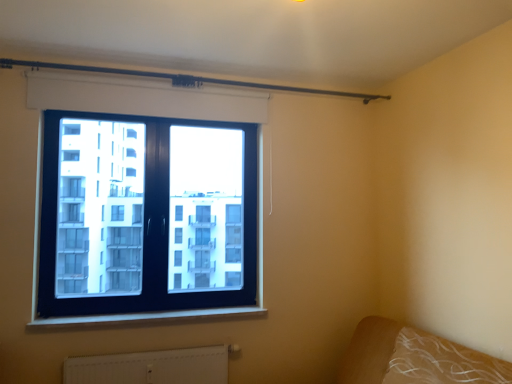
Question: Is metallic rod at upper center looking in the opposite direction of brown fabric bed at lower right?

Choices:
 (A) no
 (B) yes

Answer: (A)

Question: Is metallic rod at upper center completely or partially outside of brown fabric bed at lower right?

Choices:
 (A) yes
 (B) no

Answer: (A)

Question: Could you tell me if metallic rod at upper center is facing brown fabric bed at lower right?

Choices:
 (A) yes
 (B) no

Answer: (B)

Question: From the image's perspective, is metallic rod at upper center on top of brown fabric bed at lower right?

Choices:
 (A) yes
 (B) no

Answer: (A)

Question: Is metallic rod at upper center smaller than brown fabric bed at lower right?

Choices:
 (A) no
 (B) yes

Answer: (B)

Question: In the image, is black glass window at upper left positioned in front of or behind white plastic window sill at lower center?

Choices:
 (A) behind
 (B) front

Answer: (A)

Question: From the image's perspective, is black glass window at upper left above or below white plastic window sill at lower center?

Choices:
 (A) above
 (B) below

Answer: (A)

Question: From their relative heights in the image, would you say black glass window at upper left is taller or shorter than white plastic window sill at lower center?

Choices:
 (A) short
 (B) tall

Answer: (B)

Question: Looking at the image, does black glass window at upper left seem bigger or smaller compared to white plastic window sill at lower center?

Choices:
 (A) small
 (B) big

Answer: (B)

Question: From the image's perspective, relative to brown fabric bed at lower right, is black glass window at upper left above or below?

Choices:
 (A) below
 (B) above

Answer: (B)

Question: Is black glass window at upper left bigger or smaller than brown fabric bed at lower right?

Choices:
 (A) small
 (B) big

Answer: (A)

Question: From their relative heights in the image, would you say black glass window at upper left is taller or shorter than brown fabric bed at lower right?

Choices:
 (A) tall
 (B) short

Answer: (A)

Question: Is black glass window at upper left inside or outside of brown fabric bed at lower right?

Choices:
 (A) outside
 (B) inside

Answer: (A)

Question: Is white plastic window sill at lower center bigger or smaller than black glass window at upper left?

Choices:
 (A) small
 (B) big

Answer: (A)

Question: Is white plastic window sill at lower center inside the boundaries of black glass window at upper left, or outside?

Choices:
 (A) outside
 (B) inside

Answer: (A)